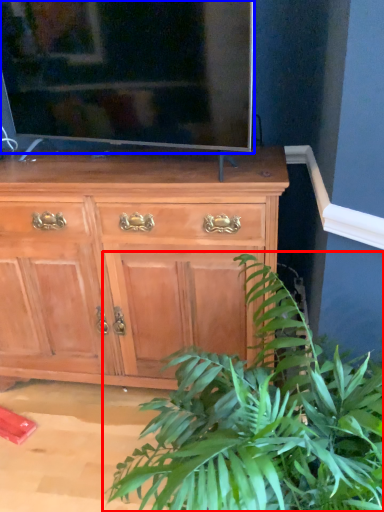
Question: Which object appears closest to the camera in this image, houseplant (highlighted by a red box) or television (highlighted by a blue box)?

Choices:
 (A) houseplant
 (B) television

Answer: (A)